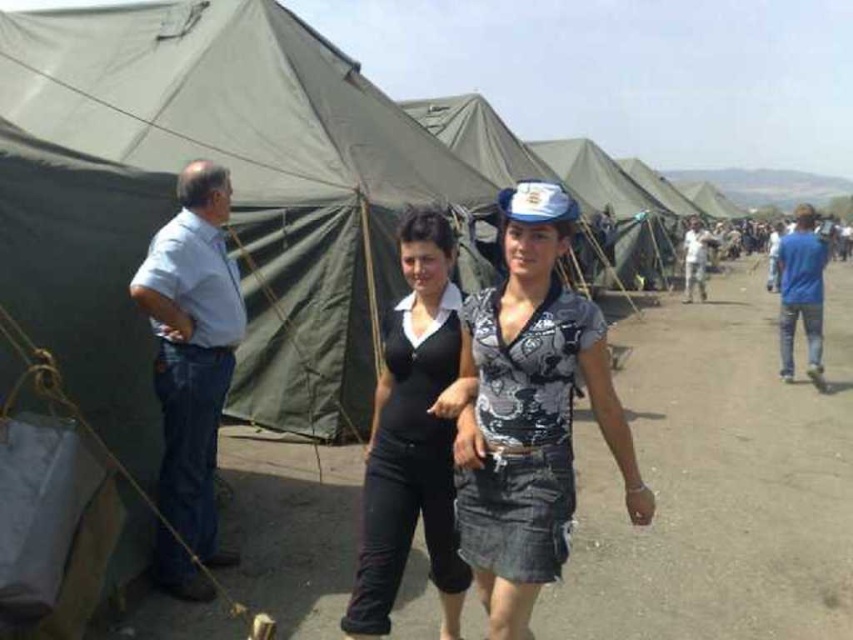
Can you confirm if black matte pants at center is taller than blue denim jeans at right?

In fact, black matte pants at center may be shorter than blue denim jeans at right.

Can you confirm if black matte pants at center is shorter than blue denim jeans at right?

Correct, black matte pants at center is not as tall as blue denim jeans at right.

You are a GUI agent. You are given a task and a screenshot of the screen. Output one action in this format:
    pyautogui.click(x=<x>, y=<y>)
    Task: Click on the black matte pants at center
    This screenshot has width=853, height=640.
    Given the screenshot: What is the action you would take?
    pyautogui.click(x=413, y=436)

This screenshot has height=640, width=853. I want to click on black matte pants at center, so click(413, 436).

Does denim skirt at center lie behind black matte pants at center?

No, denim skirt at center is closer to the viewer.

Identify the location of denim skirt at center. This screenshot has height=640, width=853. (531, 413).

Where is `denim skirt at center`? The width and height of the screenshot is (853, 640). denim skirt at center is located at coordinates (531, 413).

Measure the distance between point [550,324] and camera.

The distance of point [550,324] from camera is 2.67 meters.

Who is more distant from viewer, (520, 572) or (817, 301)?

Positioned behind is point (817, 301).

Is point (491, 584) in front of point (809, 237)?

Yes, it is in front of point (809, 237).

This screenshot has height=640, width=853. I want to click on denim skirt at center, so tap(531, 413).